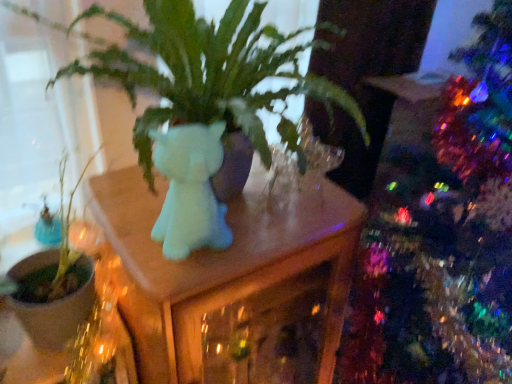
Where is `vacant area located to the right-hand side of matte white cat at center`? This screenshot has width=512, height=384. vacant area located to the right-hand side of matte white cat at center is located at coordinates (259, 230).